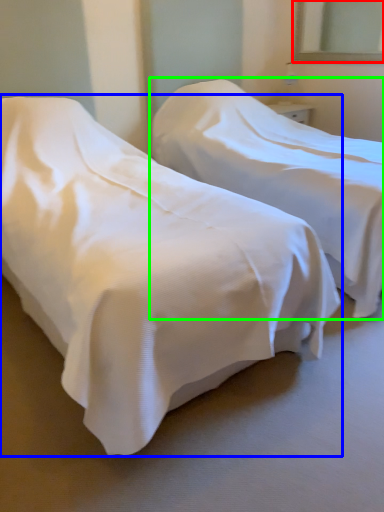
Question: Which object is positioned farthest from mirror (highlighted by a red box)? Select from bed (highlighted by a blue box) and bed (highlighted by a green box).

Choices:
 (A) bed
 (B) bed

Answer: (A)